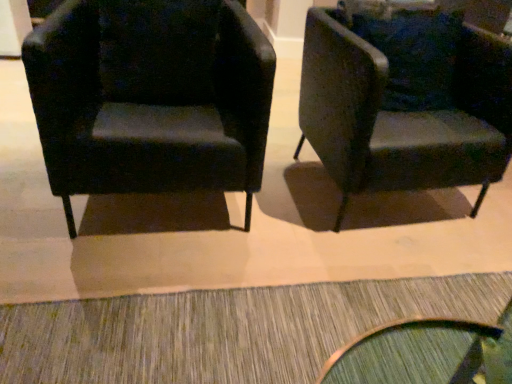
Locate an element on the screen. free space that is in between velvet dark green armchair at right, which is the second chair from left to right, and textured gray doormat at lower center is located at coordinates (283, 233).